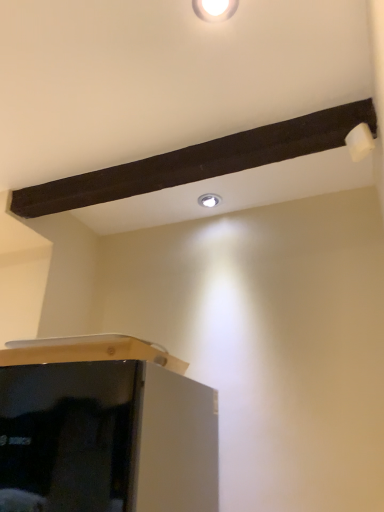
Describe the element at coordinates (209, 200) in the screenshot. I see `white glossy droplight at upper center` at that location.

I want to click on white glossy droplight at upper center, so click(x=209, y=200).

Describe the element at coordinates (214, 9) in the screenshot. I see `white glossy light fixture at upper center` at that location.

At what (x,y) coordinates should I click in order to perform the action: click on white glossy light fixture at upper center. Please return your answer as a coordinate pair (x, y). This screenshot has width=384, height=512. Looking at the image, I should click on (214, 9).

The height and width of the screenshot is (512, 384). I want to click on white glossy droplight at upper center, so click(x=209, y=200).

Can you confirm if white glossy droplight at upper center is positioned to the left of white glossy light fixture at upper center?

In fact, white glossy droplight at upper center is to the right of white glossy light fixture at upper center.

Relative to white glossy light fixture at upper center, is white glossy droplight at upper center in front or behind?

Clearly, white glossy droplight at upper center is behind white glossy light fixture at upper center.

Is point (213, 201) farther from viewer compared to point (236, 0)?

Yes, it is.

From the image's perspective, is white glossy droplight at upper center on top of white glossy light fixture at upper center?

Incorrect, from the image's perspective, white glossy droplight at upper center is lower than white glossy light fixture at upper center.

From a real-world perspective, is white glossy droplight at upper center located higher than white glossy light fixture at upper center?

Correct, in the physical world, white glossy droplight at upper center is higher than white glossy light fixture at upper center.

Can you confirm if white glossy droplight at upper center is wider than white glossy light fixture at upper center?

No.

Is white glossy droplight at upper center taller or shorter than white glossy light fixture at upper center?

Clearly, white glossy droplight at upper center is shorter compared to white glossy light fixture at upper center.

Considering the sizes of objects white glossy droplight at upper center and white glossy light fixture at upper center in the image provided, who is smaller, white glossy droplight at upper center or white glossy light fixture at upper center?

With smaller size is white glossy droplight at upper center.

Is white glossy droplight at upper center located outside white glossy light fixture at upper center?

Yes, white glossy droplight at upper center is outside of white glossy light fixture at upper center.

Is white glossy droplight at upper center far away from white glossy light fixture at upper center?

They are positioned close to each other.

Is white glossy droplight at upper center turned away from white glossy light fixture at upper center?

That's not correct — white glossy droplight at upper center is not looking away from white glossy light fixture at upper center.

How different are the orientations of white glossy droplight at upper center and white glossy light fixture at upper center in degrees?

46.2 degrees.

How distant is white glossy droplight at upper center from white glossy light fixture at upper center?

They are 33.67 inches apart.

Find the location of a particular element. droplight lying below the white glossy light fixture at upper center (from the image's perspective) is located at coordinates (209, 200).

Between white glossy light fixture at upper center and white glossy droplight at upper center, which one appears on the right side from the viewer's perspective?

white glossy droplight at upper center is more to the right.

Which is behind, white glossy light fixture at upper center or white glossy droplight at upper center?

Positioned behind is white glossy droplight at upper center.

Considering the positions of point (205, 16) and point (204, 200), is point (205, 16) closer or farther from the camera than point (204, 200)?

Point (205, 16) is closer to the camera than point (204, 200).

From the image's perspective, which one is positioned higher, white glossy light fixture at upper center or white glossy droplight at upper center?

white glossy light fixture at upper center appears higher in the image.

From a real-world perspective, relative to white glossy droplight at upper center, is white glossy light fixture at upper center vertically above or below?

white glossy light fixture at upper center is situated lower than white glossy droplight at upper center in the real world.

Does white glossy light fixture at upper center have a greater width compared to white glossy droplight at upper center?

Indeed, white glossy light fixture at upper center has a greater width compared to white glossy droplight at upper center.

Considering the sizes of objects white glossy light fixture at upper center and white glossy droplight at upper center in the image provided, who is taller, white glossy light fixture at upper center or white glossy droplight at upper center?

With more height is white glossy light fixture at upper center.

Based on their sizes in the image, would you say white glossy light fixture at upper center is bigger or smaller than white glossy droplight at upper center?

In the image, white glossy light fixture at upper center appears to be larger than white glossy droplight at upper center.

Based on the photo, is white glossy light fixture at upper center outside of white glossy droplight at upper center?

Absolutely, white glossy light fixture at upper center is external to white glossy droplight at upper center.

Is the surface of white glossy light fixture at upper center in direct contact with white glossy droplight at upper center?

There is a gap between white glossy light fixture at upper center and white glossy droplight at upper center.

Is white glossy light fixture at upper center aimed at white glossy droplight at upper center?

Answer: No.

What's the angular difference between white glossy light fixture at upper center and white glossy droplight at upper center's facing directions?

46.2 degrees.

The image size is (384, 512). I want to click on droplight below the white glossy light fixture at upper center (from the image's perspective), so click(x=209, y=200).

This screenshot has width=384, height=512. What are the coordinates of `droplight on the right of white glossy light fixture at upper center` in the screenshot? It's located at (209, 200).

This screenshot has height=512, width=384. Find the location of `droplight that is behind the white glossy light fixture at upper center`. droplight that is behind the white glossy light fixture at upper center is located at coordinates (209, 200).